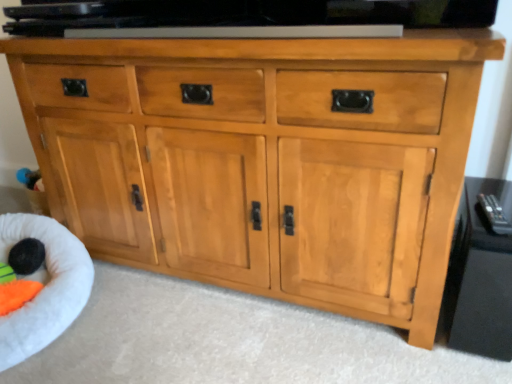
Locate an element on the screen. This screenshot has height=384, width=512. vacant area that is situated to the right of white plush infant bed at lower left is located at coordinates (156, 314).